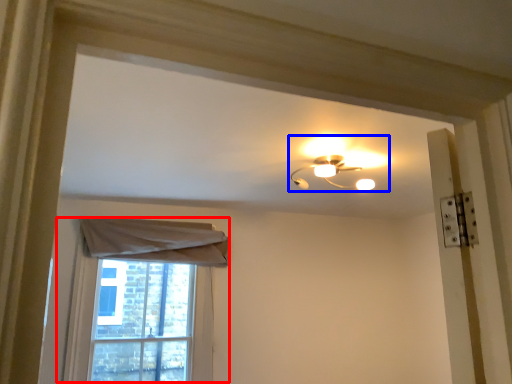
Question: Which object is further to the camera taking this photo, window (highlighted by a red box) or lamp (highlighted by a blue box)?

Choices:
 (A) window
 (B) lamp

Answer: (A)